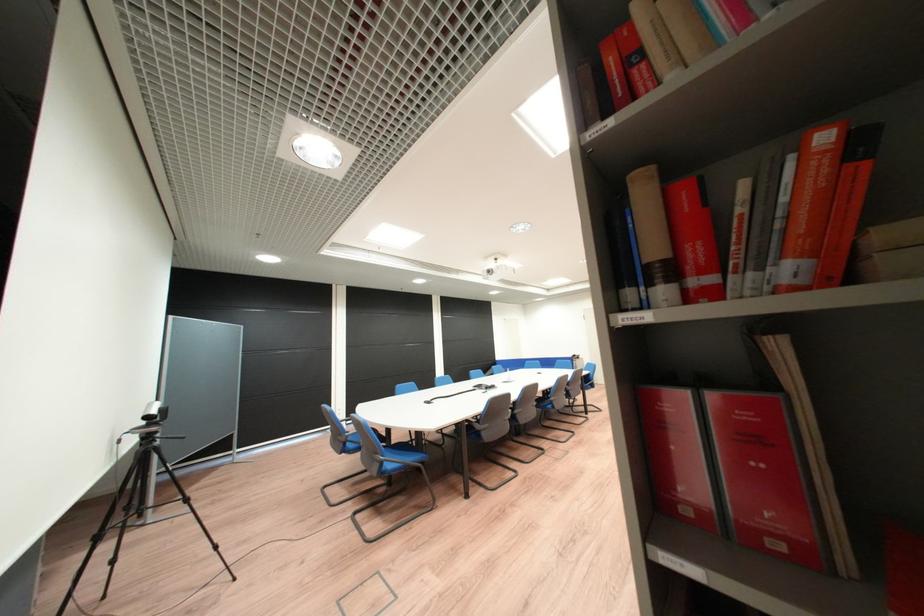
Find where to sit the blue chair sitting surface. Please return your answer as a coordinate pair (x, y).

(394, 452)